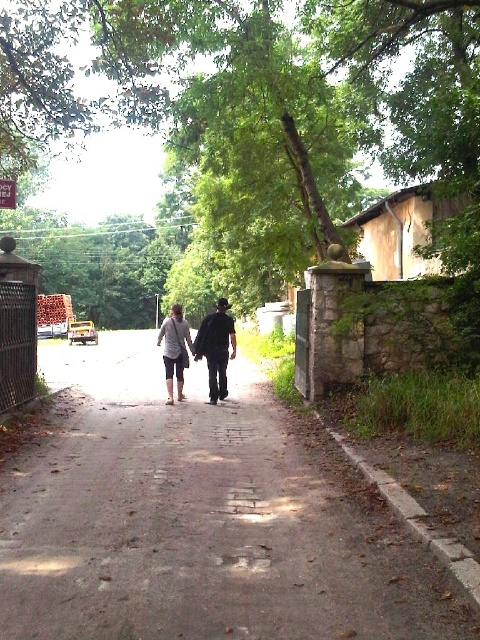
You are a delivery person standing at the metal gate on the left side of the path. You need to place a package on the dull gray concrete path at center. Can you reach the path without stepping onto the dark gray fabric pants at center?

The distance between the dull gray concrete path at center and the dark gray fabric pants at center is 10.55 feet, so you can safely reach the path without stepping onto the pants.